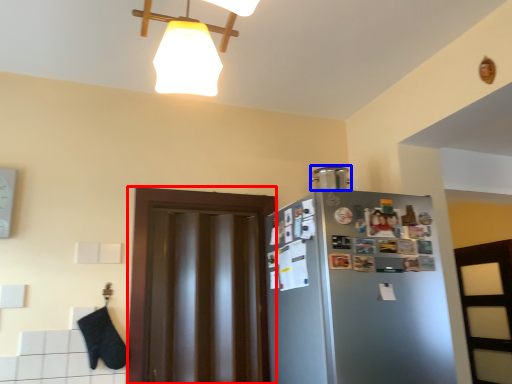
Question: Which of the following is the closest to the observer, glass door (highlighted by a red box) or appliance (highlighted by a blue box)?

Choices:
 (A) glass door
 (B) appliance

Answer: (A)